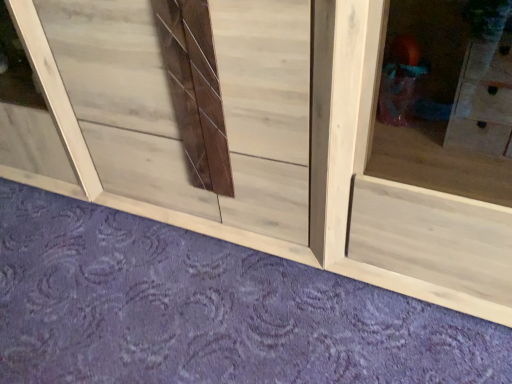
Question: Is natural wood window frame at lower left at the left side of natural wood cabinet at lower center?

Choices:
 (A) yes
 (B) no

Answer: (A)

Question: Can you confirm if natural wood window frame at lower left is wider than natural wood cabinet at lower center?

Choices:
 (A) no
 (B) yes

Answer: (A)

Question: Is natural wood window frame at lower left not inside natural wood cabinet at lower center?

Choices:
 (A) yes
 (B) no

Answer: (A)

Question: Is the position of natural wood window frame at lower left more distant than that of natural wood cabinet at lower center?

Choices:
 (A) yes
 (B) no

Answer: (A)

Question: Is natural wood window frame at lower left smaller than natural wood cabinet at lower center?

Choices:
 (A) no
 (B) yes

Answer: (A)

Question: Can you confirm if natural wood window frame at lower left is bigger than natural wood cabinet at lower center?

Choices:
 (A) yes
 (B) no

Answer: (A)

Question: Considering the relative positions of natural wood cabinet at lower center and natural wood window frame at lower left in the image provided, is natural wood cabinet at lower center to the right of natural wood window frame at lower left from the viewer's perspective?

Choices:
 (A) yes
 (B) no

Answer: (A)

Question: Is natural wood cabinet at lower center looking in the opposite direction of natural wood window frame at lower left?

Choices:
 (A) no
 (B) yes

Answer: (A)

Question: Can you confirm if natural wood cabinet at lower center is wider than natural wood window frame at lower left?

Choices:
 (A) no
 (B) yes

Answer: (B)

Question: Can you confirm if natural wood cabinet at lower center is shorter than natural wood window frame at lower left?

Choices:
 (A) yes
 (B) no

Answer: (A)

Question: From the image's perspective, would you say natural wood cabinet at lower center is shown under natural wood window frame at lower left?

Choices:
 (A) yes
 (B) no

Answer: (A)

Question: Is natural wood cabinet at lower center closer to the viewer compared to natural wood window frame at lower left?

Choices:
 (A) yes
 (B) no

Answer: (A)

Question: From the image's perspective, is natural wood cabinet at lower center located above or below natural wood window frame at lower left?

Choices:
 (A) below
 (B) above

Answer: (A)